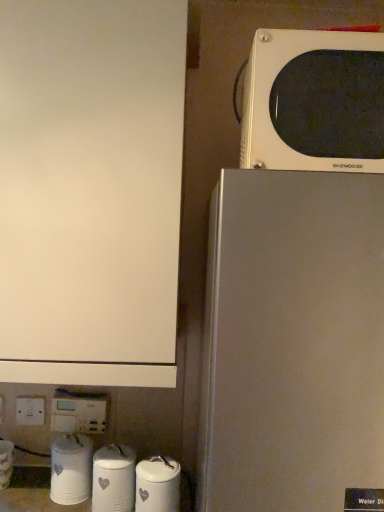
At what (x,y) coordinates should I click in order to perform the action: click on white glossy canister at lower center, the third appliance in the left-to-right sequence. Please return your answer as a coordinate pair (x, y). The width and height of the screenshot is (384, 512). Looking at the image, I should click on (113, 479).

Locate an element on the screen. satin silver refrigerator at right is located at coordinates coord(293,343).

Measure the distance between point (1,480) and camera.

Point (1,480) and camera are 3.84 feet apart.

At what (x,y) coordinates should I click in order to perform the action: click on white glossy water filter at lower left, positioned as the 4th appliance in right-to-left order. Please return your answer as a coordinate pair (x, y). Image resolution: width=384 pixels, height=512 pixels. Looking at the image, I should click on (6, 463).

Measure the distance between white glossy canisters at lower left, acting as the third appliance starting from the right, and camera.

They are 3.63 feet apart.

What do you see at coordinates (314, 102) in the screenshot? This screenshot has width=384, height=512. I see `white matte microwave at upper right` at bounding box center [314, 102].

At what (x,y) coordinates should I click in order to perform the action: click on white plastic electric outlet at lower left. Please return your answer as a coordinate pair (x, y). Looking at the image, I should click on (79, 413).

The height and width of the screenshot is (512, 384). What are the coordinates of `white glossy canister at lower center, which is the 4th appliance in left-to-right order` in the screenshot? It's located at (158, 485).

Considering the positions of objects white glossy water filter at lower left, positioned as the 4th appliance in right-to-left order, and white glossy canister at lower center, which is the 4th appliance in left-to-right order, in the image provided, who is in front, white glossy water filter at lower left, positioned as the 4th appliance in right-to-left order, or white glossy canister at lower center, which is the 4th appliance in left-to-right order,?

white glossy canister at lower center, which is the 4th appliance in left-to-right order, is closer to the camera.

Which object is thinner, white glossy water filter at lower left, the first appliance positioned from the left, or white glossy canister at lower center, which is the 4th appliance in left-to-right order?

white glossy canister at lower center, which is the 4th appliance in left-to-right order, is thinner.

Does white glossy water filter at lower left, the first appliance positioned from the left, have a lesser height compared to white glossy canister at lower center, which is the 4th appliance in left-to-right order?

Yes, white glossy water filter at lower left, the first appliance positioned from the left, is shorter than white glossy canister at lower center, which is the 4th appliance in left-to-right order.

Is white glossy canister at lower center, the 1th appliance viewed from the right, completely or partially inside white glossy water filter at lower left, positioned as the 4th appliance in right-to-left order?

No.

From a real-world perspective, is satin silver refrigerator at right above or below white glossy canister at lower center, which is the second appliance from right to left?

Clearly, from a real-world perspective, satin silver refrigerator at right is above white glossy canister at lower center, which is the second appliance from right to left.

Is white glossy canister at lower center, the third appliance in the left-to-right sequence, at the back of satin silver refrigerator at right?

That's not correct — satin silver refrigerator at right is not looking away from white glossy canister at lower center, the third appliance in the left-to-right sequence.

Is there a large distance between satin silver refrigerator at right and white glossy canister at lower center, which is the second appliance from right to left?

That's not correct — satin silver refrigerator at right is a little close to white glossy canister at lower center, which is the second appliance from right to left.

Is satin silver refrigerator at right smaller than white glossy canister at lower center, the third appliance in the left-to-right sequence?

No, satin silver refrigerator at right is not smaller than white glossy canister at lower center, the third appliance in the left-to-right sequence.

Is white matte cabinet at upper left far from white glossy canisters at lower left, acting as the third appliance starting from the right?

No, there isn't a large distance between white matte cabinet at upper left and white glossy canisters at lower left, acting as the third appliance starting from the right.

Consider the image. Considering the relative sizes of white matte cabinet at upper left and white glossy canisters at lower left, the second appliance from the left, in the image provided, is white matte cabinet at upper left bigger than white glossy canisters at lower left, the second appliance from the left,?

Yes.

Is white matte cabinet at upper left taller than white glossy canisters at lower left, acting as the third appliance starting from the right?

Indeed, white matte cabinet at upper left has a greater height compared to white glossy canisters at lower left, acting as the third appliance starting from the right.

Find the location of `appliance that is the 1st object to the left of the white matte cabinet at upper left, starting at the anchor`. appliance that is the 1st object to the left of the white matte cabinet at upper left, starting at the anchor is located at coordinates (71, 469).

Is white plastic electric outlet at lower left far away from white glossy canister at lower center, which is the second appliance from right to left?

No, there isn't a large distance between white plastic electric outlet at lower left and white glossy canister at lower center, which is the second appliance from right to left.

Is white plastic electric outlet at lower left positioned behind white glossy canister at lower center, the third appliance in the left-to-right sequence?

A: That is True.

Locate an element on the screen. The height and width of the screenshot is (512, 384). electric outlet on the left of the white glossy canister at lower center, which is the second appliance from right to left is located at coordinates click(79, 413).

Does white plastic electric outlet at lower left have a larger size compared to white glossy canister at lower center, which is the second appliance from right to left?

Actually, white plastic electric outlet at lower left might be smaller than white glossy canister at lower center, which is the second appliance from right to left.

Considering the sizes of white plastic electric outlet at lower left and satin silver refrigerator at right in the image, is white plastic electric outlet at lower left taller or shorter than satin silver refrigerator at right?

Considering their sizes, white plastic electric outlet at lower left has less height than satin silver refrigerator at right.

Is white plastic electric outlet at lower left wider or thinner than satin silver refrigerator at right?

Considering their sizes, white plastic electric outlet at lower left looks slimmer than satin silver refrigerator at right.

Between white plastic electric outlet at lower left and satin silver refrigerator at right, which one has smaller size?

white plastic electric outlet at lower left is smaller.

Is white plastic electric outlet at lower left facing away from satin silver refrigerator at right?

That's not correct — white plastic electric outlet at lower left is not looking away from satin silver refrigerator at right.

Is white glossy canister at lower center, the third appliance in the left-to-right sequence, bigger than white plastic electric outlet at lower left?

Yes, white glossy canister at lower center, the third appliance in the left-to-right sequence, is bigger than white plastic electric outlet at lower left.

From the picture: Which is in front, white glossy canister at lower center, which is the second appliance from right to left, or white plastic electric outlet at lower left?

Positioned in front is white glossy canister at lower center, which is the second appliance from right to left.

From the image's perspective, which is above, white glossy canister at lower center, which is the second appliance from right to left, or white plastic electric outlet at lower left?

white plastic electric outlet at lower left is shown above in the image.

Considering the relative sizes of white glossy canister at lower center, the third appliance in the left-to-right sequence, and white plastic electric outlet at lower left in the image provided, is white glossy canister at lower center, the third appliance in the left-to-right sequence, thinner than white plastic electric outlet at lower left?

No, white glossy canister at lower center, the third appliance in the left-to-right sequence, is not thinner than white plastic electric outlet at lower left.

Does white glossy canister at lower center, the third appliance in the left-to-right sequence, have a lesser height compared to white glossy water filter at lower left, positioned as the 4th appliance in right-to-left order?

No.

Which of these two, white glossy canister at lower center, the third appliance in the left-to-right sequence, or white glossy water filter at lower left, positioned as the 4th appliance in right-to-left order, is bigger?

white glossy canister at lower center, the third appliance in the left-to-right sequence, is bigger.

From a real-world perspective, is white glossy canister at lower center, which is the second appliance from right to left, physically below white glossy water filter at lower left, the first appliance positioned from the left?

No, from a real-world perspective, white glossy canister at lower center, which is the second appliance from right to left, is not under white glossy water filter at lower left, the first appliance positioned from the left.

This screenshot has width=384, height=512. Identify the location of the 3rd appliance in front of the white glossy water filter at lower left, positioned as the 4th appliance in right-to-left order. (158, 485).

From the image's perspective, which appliance is the 3rd one below the satin silver refrigerator at right? Please provide its 2D coordinates.

[(113, 479)]

Estimate the real-world distances between objects in this image. Which object is further from white matte microwave at upper right, white glossy water filter at lower left, the first appliance positioned from the left, or white plastic electric outlet at lower left?

The object further to white matte microwave at upper right is white glossy water filter at lower left, the first appliance positioned from the left.

When comparing their distances from white glossy water filter at lower left, positioned as the 4th appliance in right-to-left order, does satin silver refrigerator at right or white plastic electric outlet at lower left seem further?

satin silver refrigerator at right.

Considering their positions, is white matte cabinet at upper left positioned closer to satin silver refrigerator at right than white glossy canister at lower center, the 1th appliance viewed from the right?

Based on the image, white matte cabinet at upper left appears to be nearer to satin silver refrigerator at right.

Based on their spatial positions, is white glossy canisters at lower left, the second appliance from the left, or white plastic electric outlet at lower left closer to white matte microwave at upper right?

Among the two, white plastic electric outlet at lower left is located nearer to white matte microwave at upper right.

Based on their spatial positions, is white matte cabinet at upper left or white glossy canister at lower center, the third appliance in the left-to-right sequence, further from white plastic electric outlet at lower left?

Based on the image, white matte cabinet at upper left appears to be further to white plastic electric outlet at lower left.

When comparing their distances from white glossy water filter at lower left, positioned as the 4th appliance in right-to-left order, does white matte cabinet at upper left or white glossy canister at lower center, the third appliance in the left-to-right sequence, seem further?

white matte cabinet at upper left is positioned further to the anchor white glossy water filter at lower left, positioned as the 4th appliance in right-to-left order.

Consider the image. Based on their spatial positions, is white glossy canisters at lower left, the second appliance from the left, or white matte cabinet at upper left closer to white glossy canister at lower center, which is the 4th appliance in left-to-right order?

Based on the image, white glossy canisters at lower left, the second appliance from the left, appears to be nearer to white glossy canister at lower center, which is the 4th appliance in left-to-right order.

Which object lies nearer to the anchor point white plastic electric outlet at lower left, white glossy water filter at lower left, the first appliance positioned from the left, or satin silver refrigerator at right?

Based on the image, white glossy water filter at lower left, the first appliance positioned from the left, appears to be nearer to white plastic electric outlet at lower left.

The width and height of the screenshot is (384, 512). Identify the location of microwave oven between white matte cabinet at upper left and satin silver refrigerator at right from left to right. (314, 102).

At what (x,y) coordinates should I click in order to perform the action: click on electric outlet between white glossy water filter at lower left, the first appliance positioned from the left, and white glossy canisters at lower left, acting as the third appliance starting from the right. Please return your answer as a coordinate pair (x, y). The image size is (384, 512). Looking at the image, I should click on (79, 413).

Locate an element on the screen. The height and width of the screenshot is (512, 384). electric outlet between white matte microwave at upper right and white glossy water filter at lower left, positioned as the 4th appliance in right-to-left order, in the vertical direction is located at coordinates tap(79, 413).

Where is `electric outlet between white matte cabinet at upper left and white glossy canister at lower center, which is the second appliance from right to left, in the up-down direction`? This screenshot has height=512, width=384. electric outlet between white matte cabinet at upper left and white glossy canister at lower center, which is the second appliance from right to left, in the up-down direction is located at coordinates (79, 413).